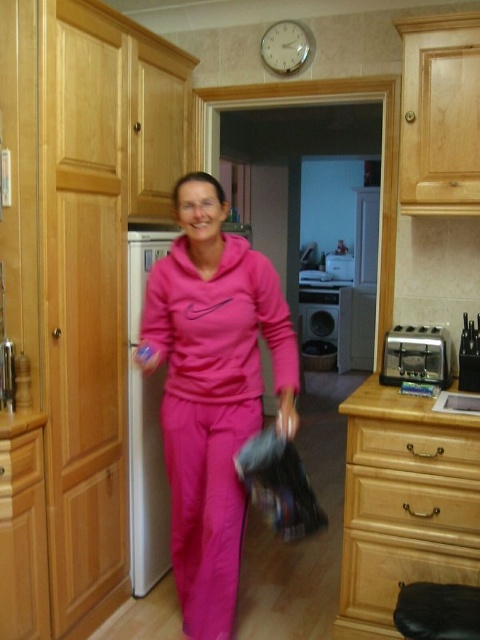
You are a delivery person who needs to place a 5 meter long package in the kitchen. The package must be placed between the black plastic dishwasher at center and the wooden drawer at lower left. Is there enough space between them to fit the package?

The black plastic dishwasher at center and wooden drawer at lower left are 5.05 meters apart, so yes, the 5 meter long package can fit between them since the distance is slightly more than the package length.

From the picture: You are trying to place a new toaster in your kitchen. The existing satin silver toaster at lower right is at position coordinates 0.556 on the x axis and 0.867 on the y axis. Where should you place the new toaster to avoid overlapping with the existing one?

You should place the new toaster at a different coordinate than 0.556 on the x axis and 0.867 on the y axis to avoid overlapping with the existing satin silver toaster at lower right.